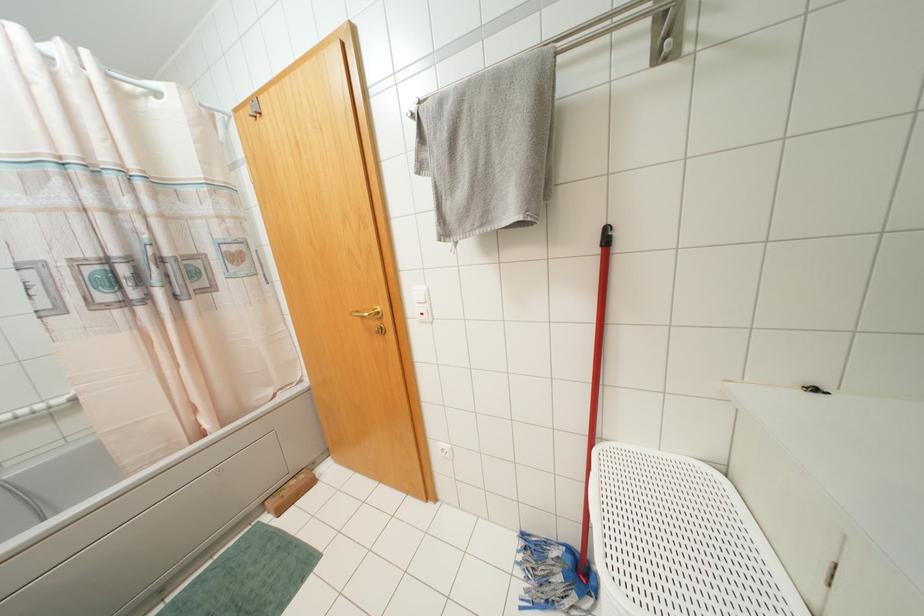
Find the location of a particular element. The image size is (924, 616). metal door hook is located at coordinates (253, 108).